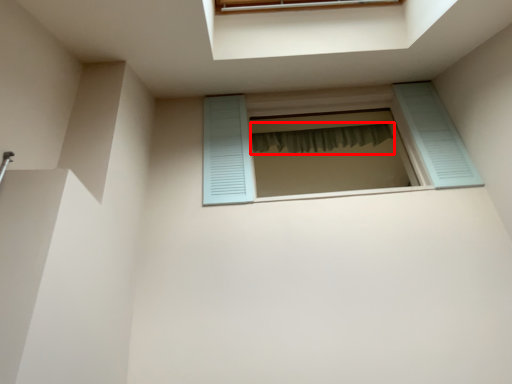
Question: Observing the image, what is the correct spatial positioning of shower curtain (annotated by the red box) in reference to window?

Choices:
 (A) right
 (B) left

Answer: (A)